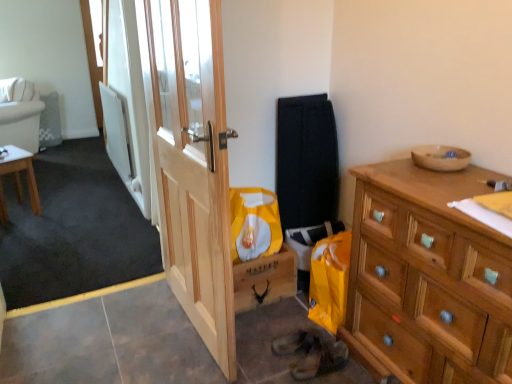
Question: From a real-world perspective, is light brown wooden table at left on top of wooden bowl at upper right?

Choices:
 (A) yes
 (B) no

Answer: (B)

Question: Can you confirm if light brown wooden table at left is wider than wooden bowl at upper right?

Choices:
 (A) no
 (B) yes

Answer: (B)

Question: Considering the relative sizes of light brown wooden table at left and wooden bowl at upper right in the image provided, is light brown wooden table at left smaller than wooden bowl at upper right?

Choices:
 (A) no
 (B) yes

Answer: (A)

Question: From the image's perspective, does light brown wooden table at left appear higher than wooden bowl at upper right?

Choices:
 (A) yes
 (B) no

Answer: (B)

Question: Does light brown wooden table at left appear on the left side of wooden bowl at upper right?

Choices:
 (A) no
 (B) yes

Answer: (B)

Question: Is wooden dresser at right wider or thinner than leather shoe at lower center?

Choices:
 (A) thin
 (B) wide

Answer: (B)

Question: In the image, is wooden dresser at right positioned in front of or behind leather shoe at lower center?

Choices:
 (A) behind
 (B) front

Answer: (B)

Question: From the image's perspective, is wooden dresser at right located above or below leather shoe at lower center?

Choices:
 (A) below
 (B) above

Answer: (B)

Question: Looking at the image, does wooden dresser at right seem bigger or smaller compared to leather shoe at lower center?

Choices:
 (A) big
 (B) small

Answer: (A)

Question: Relative to light brown wooden table at left, is white fabric pillow at upper left in front or behind?

Choices:
 (A) behind
 (B) front

Answer: (A)

Question: Considering the positions of white fabric pillow at upper left and light brown wooden table at left in the image, is white fabric pillow at upper left bigger or smaller than light brown wooden table at left?

Choices:
 (A) small
 (B) big

Answer: (A)

Question: In terms of height, does white fabric pillow at upper left look taller or shorter compared to light brown wooden table at left?

Choices:
 (A) tall
 (B) short

Answer: (B)

Question: Based on their positions, is white fabric pillow at upper left located to the left or right of light brown wooden table at left?

Choices:
 (A) right
 (B) left

Answer: (B)

Question: Is light brown wooden table at left to the left or to the right of leather shoe at lower center in the image?

Choices:
 (A) left
 (B) right

Answer: (A)

Question: Is light brown wooden table at left wider or thinner than leather shoe at lower center?

Choices:
 (A) thin
 (B) wide

Answer: (B)